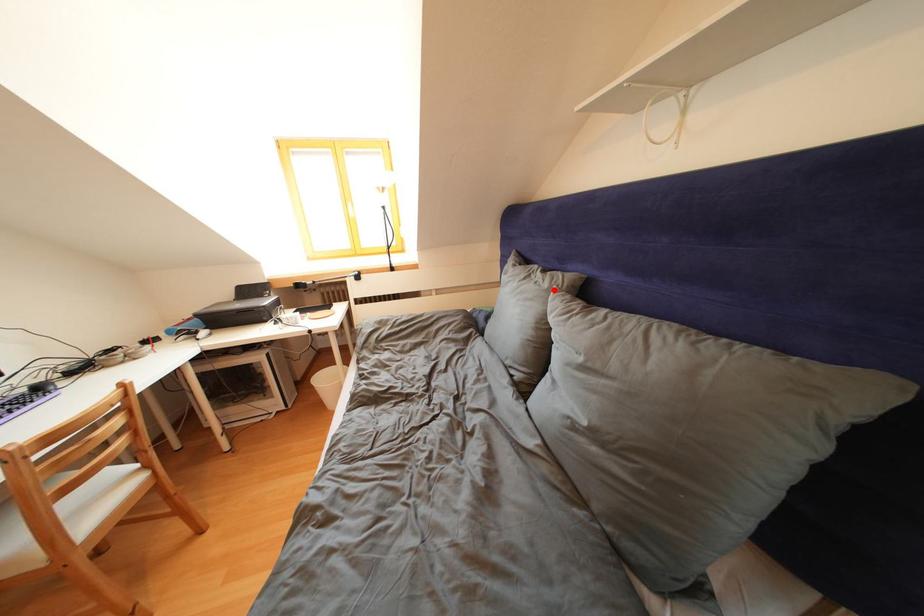
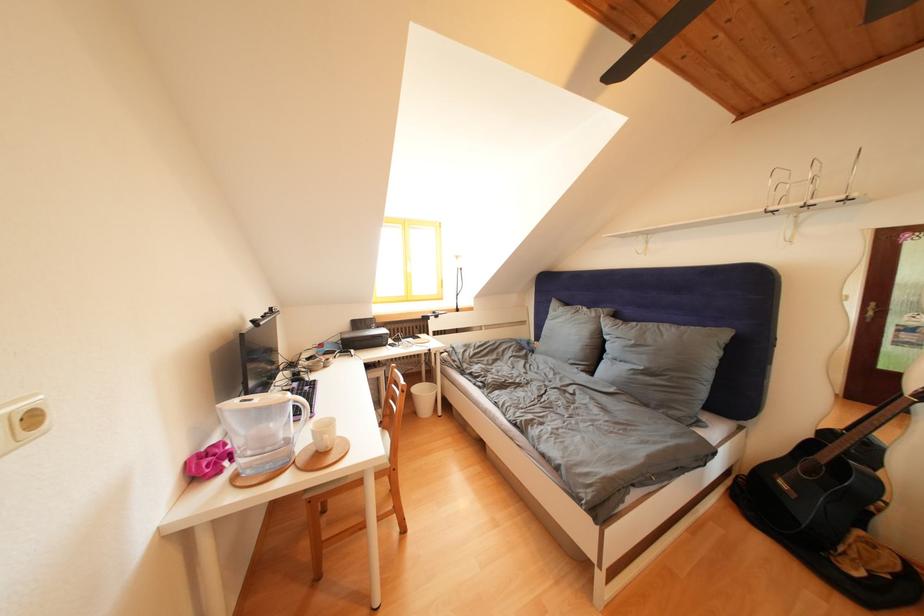
Question: I am providing you with two images of the same scene from different viewpoints. A red point is marked on the first image. Is the red point's position out of view in image 2?

Choices:
 (A) Yes
 (B) No

Answer: (B)